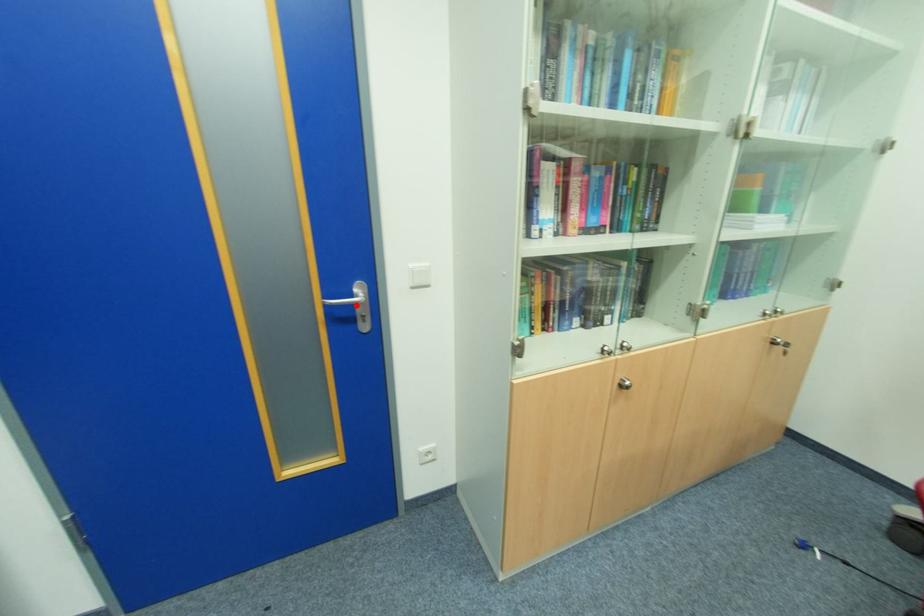
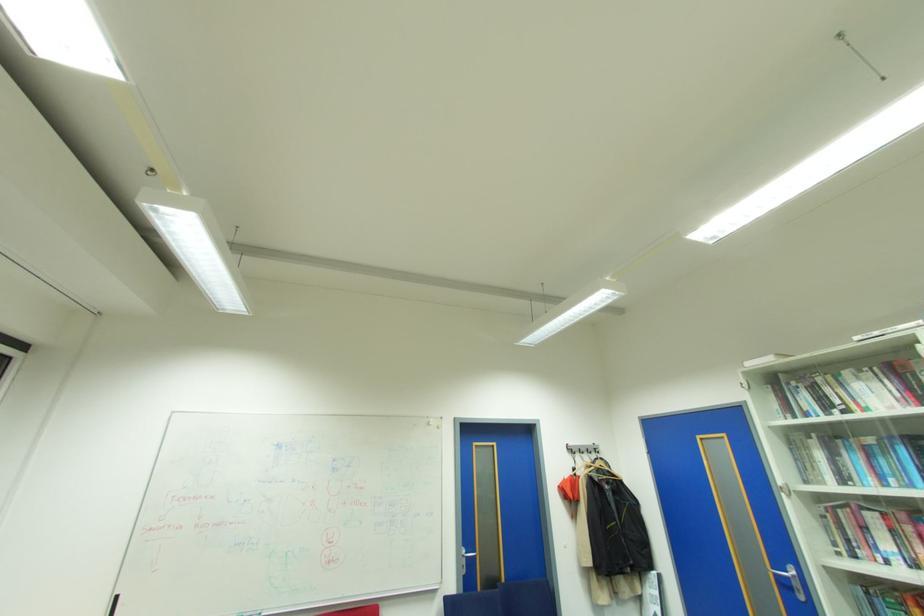
Question: I am providing you with two images of the same scene from different viewpoints. A red point is marked on the first image. Is the red point's position out of view in image 2?

Choices:
 (A) Yes
 (B) No

Answer: (B)